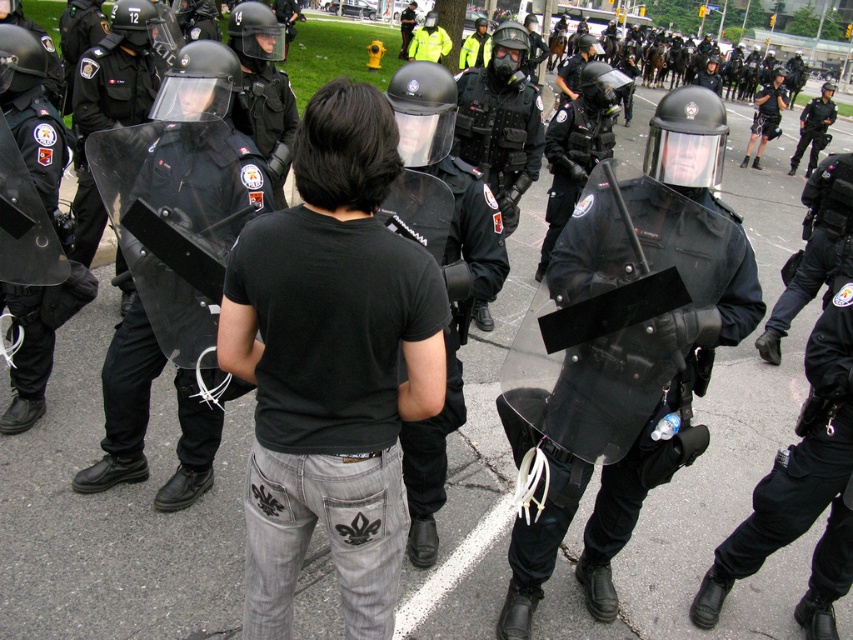
Between clear plastic shield at center and black matte shirt at center, which one is positioned lower?

clear plastic shield at center is lower down.

This screenshot has width=853, height=640. What are the coordinates of `clear plastic shield at center` in the screenshot? It's located at (622, 348).

Locate an element on the screen. clear plastic shield at center is located at coordinates (622, 348).

Is the position of black matte t-shirt at center less distant than that of black matte shirt at center?

Yes, it is.

Describe the element at coordinates (444, 276) in the screenshot. I see `black matte t-shirt at center` at that location.

Does point (421, 115) come closer to viewer compared to point (209, 54)?

Yes, point (421, 115) is closer to viewer.

You are a GUI agent. You are given a task and a screenshot of the screen. Output one action in this format:
    pyautogui.click(x=<x>, y=<y>)
    Task: Click on the black matte t-shirt at center
    The height and width of the screenshot is (640, 853).
    Given the screenshot: What is the action you would take?
    pyautogui.click(x=444, y=276)

Who is positioned more to the right, clear plastic shield at center or black matte t-shirt at center?

clear plastic shield at center

Is point (666, 157) positioned after point (451, 125)?

No, it is in front of (451, 125).

What are the coordinates of `clear plastic shield at center` in the screenshot? It's located at (622, 348).